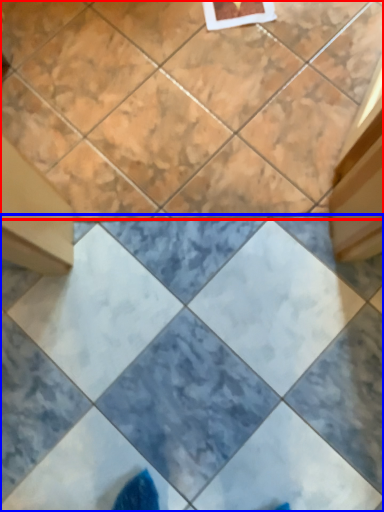
Question: Which object is further to the camera taking this photo, ceramic tile (highlighted by a red box) or ceramic tile (highlighted by a blue box)?

Choices:
 (A) ceramic tile
 (B) ceramic tile

Answer: (A)